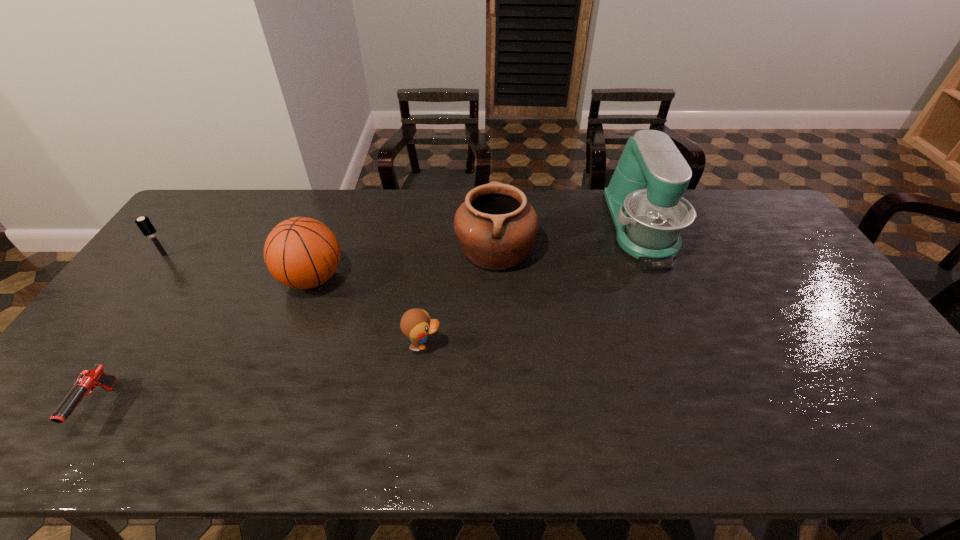
Find the location of a particular element. This screenshot has height=540, width=960. empty space that is in between the tallest object and the fifth object from left to right is located at coordinates (568, 239).

Identify the location of blank region between the duck and the third object from left to right. (368, 312).

This screenshot has width=960, height=540. What are the coordinates of `empty space that is in between the nearest object and the fourth object from right to left` in the screenshot? It's located at (205, 342).

Locate an element on the screen. free spot between the basketball and the pottery is located at coordinates (404, 265).

Identify which object is the third closest to the gun. Please provide its 2D coordinates. Your answer should be formatted as a tuple, i.e. [(x, y)], where the tuple contains the x and y coordinates of a point satisfying the conditions above.

[(416, 324)]

The height and width of the screenshot is (540, 960). Identify the location of object that stands as the second closest to the leftmost object. (88, 380).

Identify the location of vacant space that satisfies the following two spatial constraints: 1. on the front side of the basketball; 2. on the left side of the leftmost object. (147, 279).

This screenshot has width=960, height=540. What are the coordinates of `vacant space that satisfies the following two spatial constraints: 1. on the front side of the third object from left to right; 2. on the right side of the hairbrush` in the screenshot? It's located at (147, 279).